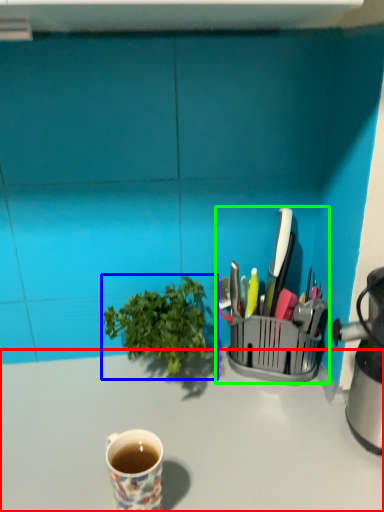
Question: Based on their relative distances, which object is nearer to desk (highlighted by a red box)? Choose from houseplant (highlighted by a blue box) and appliance (highlighted by a green box).

Choices:
 (A) houseplant
 (B) appliance

Answer: (A)